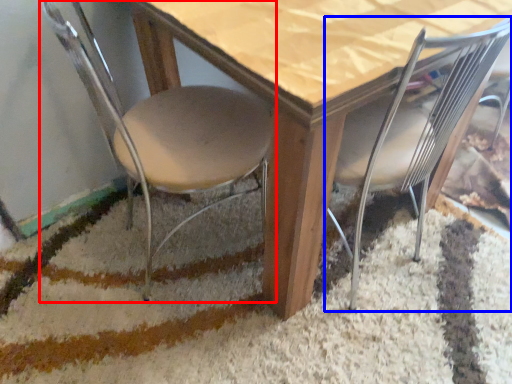
Question: Which object is further to the camera taking this photo, chair (highlighted by a red box) or chair (highlighted by a blue box)?

Choices:
 (A) chair
 (B) chair

Answer: (B)